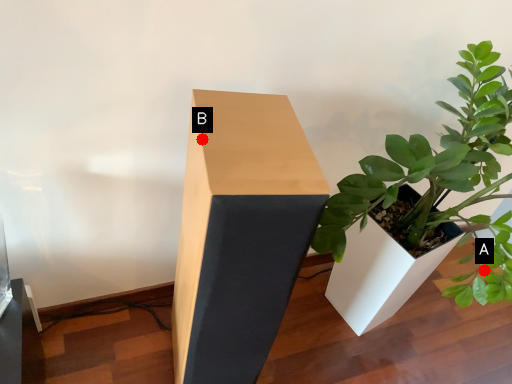
Question: Two points are circled on the image, labeled by A and B beside each circle. Which point is farther from the camera taking this photo?

Choices:
 (A) A is further
 (B) B is further

Answer: (A)